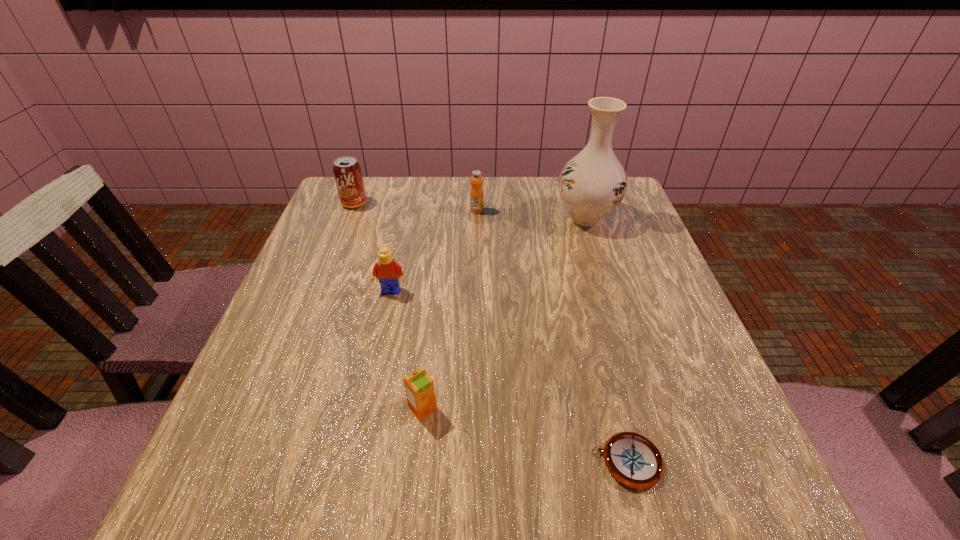
I want to click on object positioned at the left edge, so click(347, 171).

You are a GUI agent. You are given a task and a screenshot of the screen. Output one action in this format:
    pyautogui.click(x=<x>, y=<y>)
    Task: Click on the vase located in the right edge section of the desktop
    The height and width of the screenshot is (540, 960).
    Given the screenshot: What is the action you would take?
    pyautogui.click(x=592, y=183)

The image size is (960, 540). I want to click on compass that is at the right edge, so click(x=632, y=459).

At what (x,y) coordinates should I click in order to perform the action: click on object located in the far left corner section of the desktop. Please return your answer as a coordinate pair (x, y). Image resolution: width=960 pixels, height=540 pixels. Looking at the image, I should click on (347, 171).

Locate an element on the screen. object located at the far right corner is located at coordinates (592, 183).

Find the location of a particular element. object present at the near right corner is located at coordinates (632, 459).

Where is `free space at the far edge of the desktop`? This screenshot has height=540, width=960. free space at the far edge of the desktop is located at coordinates (450, 193).

The width and height of the screenshot is (960, 540). In the image, there is a desktop. Identify the location of blank space at the near edge. (525, 480).

At what (x,y) coordinates should I click in order to perform the action: click on vacant region at the left edge. Please return your answer as a coordinate pair (x, y). The width and height of the screenshot is (960, 540). Looking at the image, I should click on (305, 288).

This screenshot has width=960, height=540. Find the location of `free location at the right edge of the desktop`. free location at the right edge of the desktop is located at coordinates (664, 350).